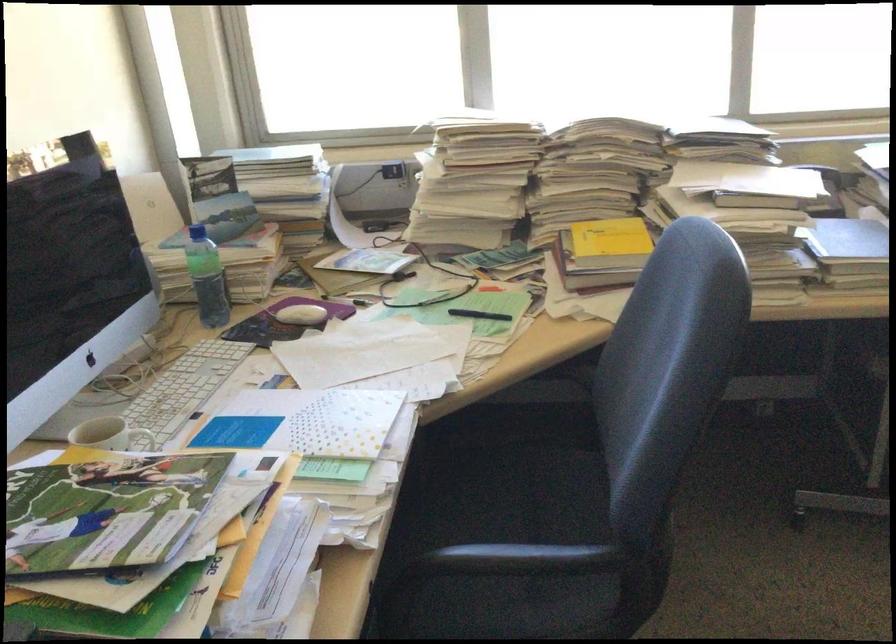
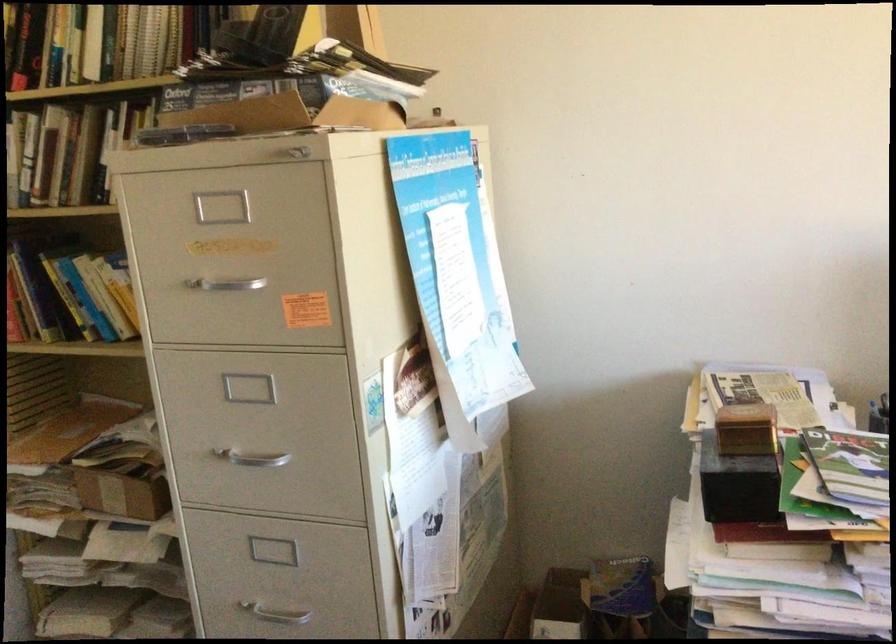
The first image is from the beginning of the video and the second image is from the end. How did the camera likely rotate when shooting the video?

The camera's rotation is toward left-down.